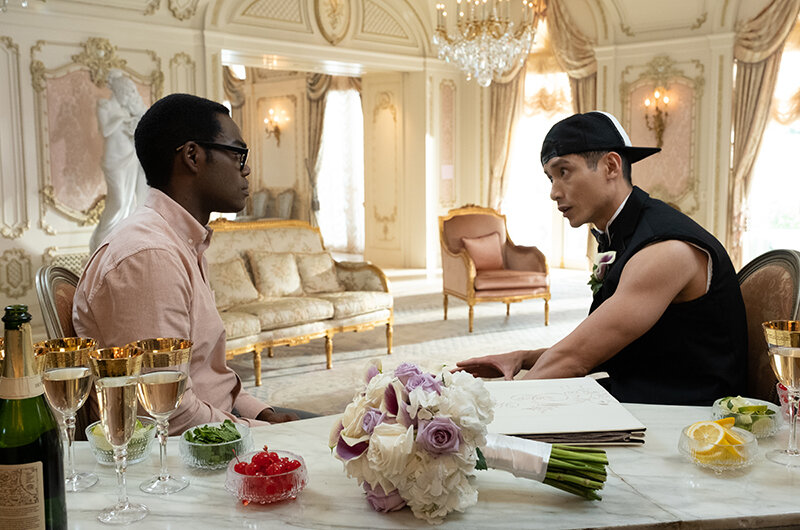
Where is `chair back`? chair back is located at coordinates (478, 223), (58, 284), (772, 303).